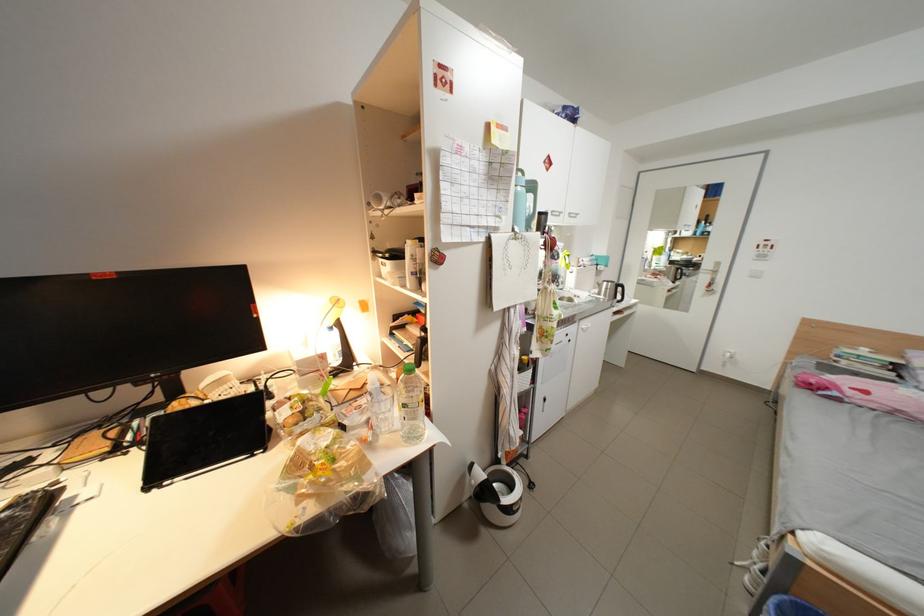
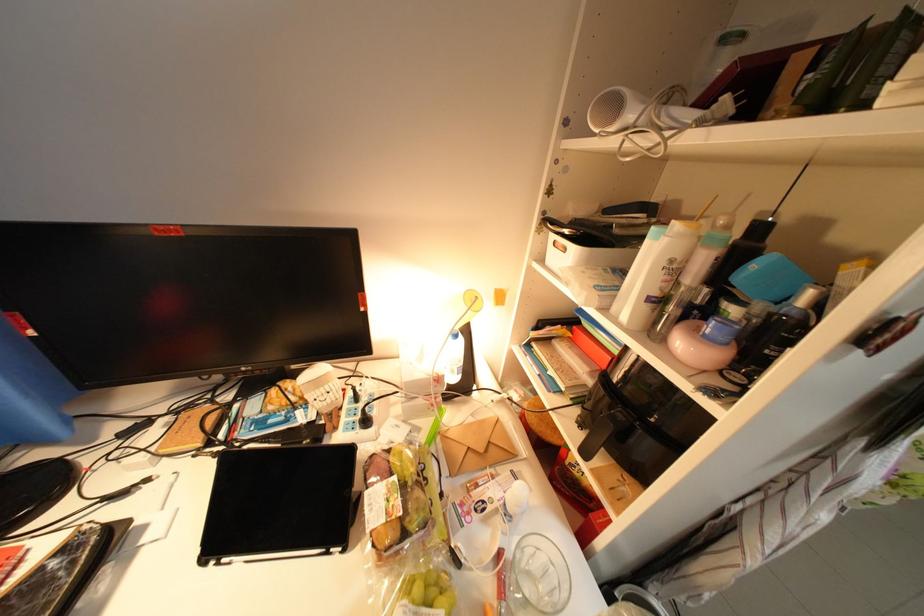
Find the pixel in the second image that matches point 383,430 in the first image.

(514, 591)